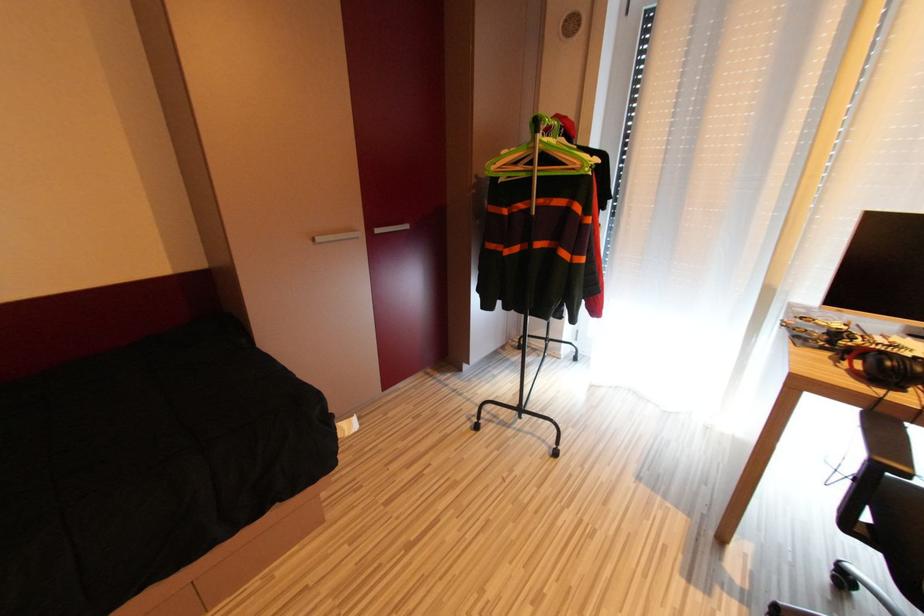
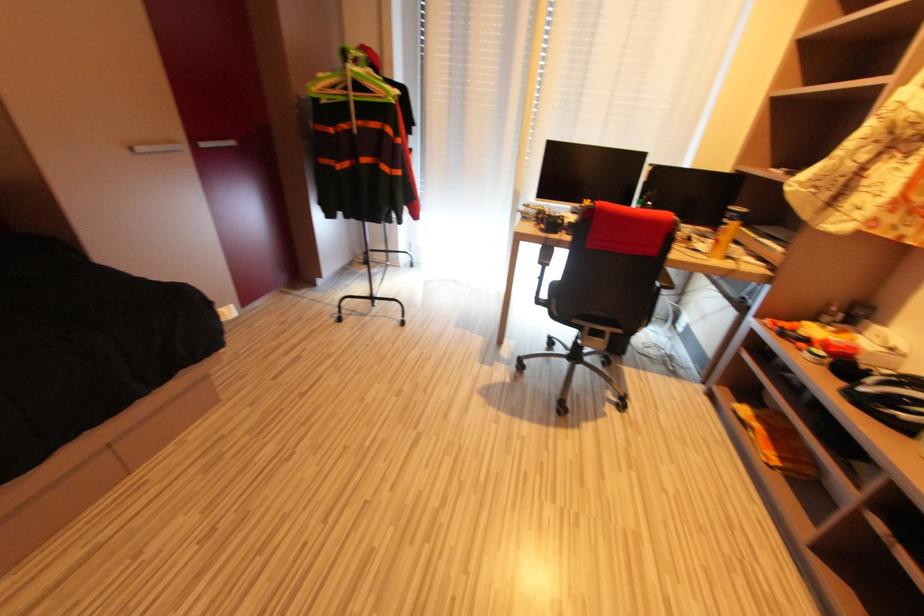
Question: The first image is from the beginning of the video and the second image is from the end. How did the camera likely rotate when shooting the video?

Choices:
 (A) Left
 (B) Right
 (C) Up
 (D) Down

Answer: (B)